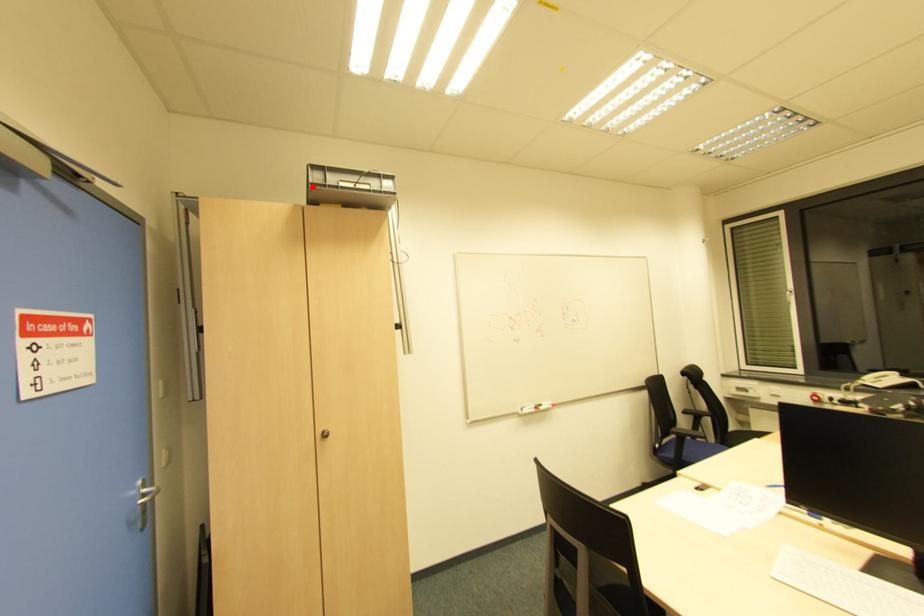
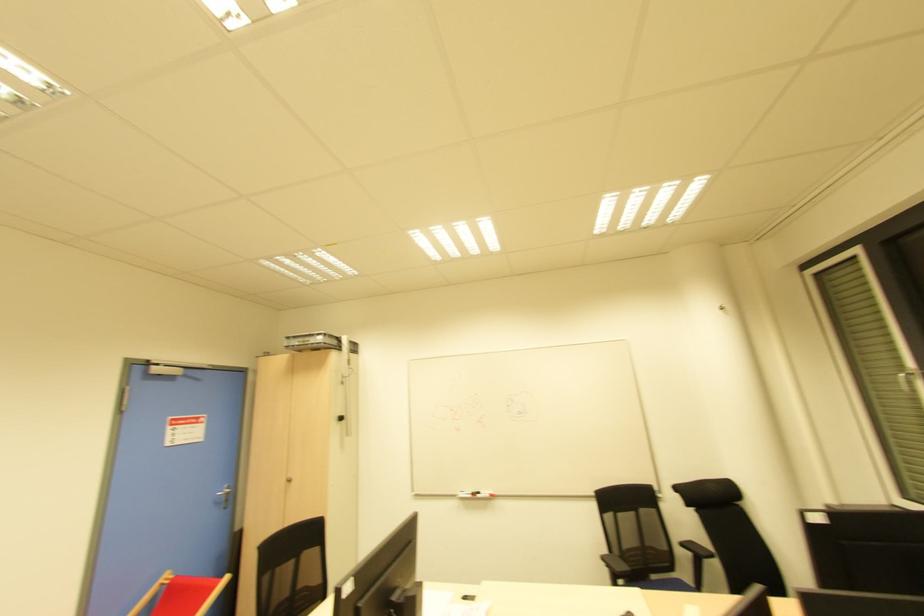
In the second image, find the point that corresponds to the highlighted location in the first image.

(286, 347)